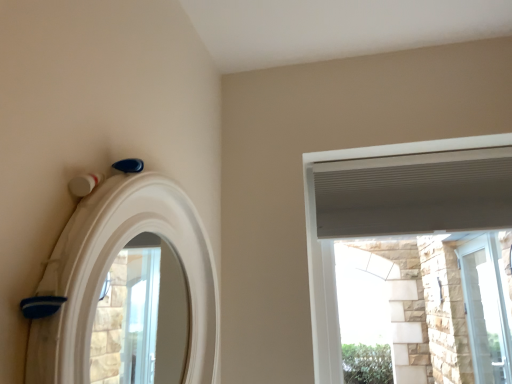
Question: Is white textured window at upper right, marked as the first window in a left-to-right arrangement, to the right of white matte archway at upper left from the viewer's perspective?

Choices:
 (A) yes
 (B) no

Answer: (A)

Question: From the image's perspective, is white textured window at upper right, which appears as the 2th window when viewed from the right, beneath white matte archway at upper left?

Choices:
 (A) yes
 (B) no

Answer: (A)

Question: Is white textured window at upper right, the 1th window positioned from the front, outside white matte archway at upper left?

Choices:
 (A) no
 (B) yes

Answer: (B)

Question: From the image's perspective, is white textured window at upper right, the 1th window positioned from the front, on white matte archway at upper left?

Choices:
 (A) yes
 (B) no

Answer: (B)

Question: Does white textured window at upper right, arranged as the 2th window when viewed from the back, come in front of white matte archway at upper left?

Choices:
 (A) no
 (B) yes

Answer: (A)

Question: Does white textured window at upper right, marked as the 1th window in a top-to-bottom arrangement, have a smaller size compared to white matte archway at upper left?

Choices:
 (A) yes
 (B) no

Answer: (B)

Question: Is white matte archway at upper left far away from clear glass door at right, the 1th window in the back-to-front sequence?

Choices:
 (A) yes
 (B) no

Answer: (A)

Question: Would you say clear glass door at right, the 1th window in the back-to-front sequence, is part of white matte archway at upper left's contents?

Choices:
 (A) yes
 (B) no

Answer: (B)

Question: Does white matte archway at upper left have a smaller size compared to clear glass door at right, the 1th window in the back-to-front sequence?

Choices:
 (A) no
 (B) yes

Answer: (A)

Question: Considering the relative sizes of white matte archway at upper left and clear glass door at right, the second window positioned from the top, in the image provided, is white matte archway at upper left shorter than clear glass door at right, the second window positioned from the top,?

Choices:
 (A) yes
 (B) no

Answer: (A)

Question: Could you tell me if white matte archway at upper left is facing clear glass door at right, the 1th window in the back-to-front sequence?

Choices:
 (A) no
 (B) yes

Answer: (A)

Question: Would you say white matte archway at upper left is outside clear glass door at right, placed as the 2th window when sorted from left to right?

Choices:
 (A) no
 (B) yes

Answer: (B)

Question: Is white textured window at upper right, which appears as the 2th window when viewed from the right, behind clear glass door at right, the first window from the right?

Choices:
 (A) no
 (B) yes

Answer: (A)